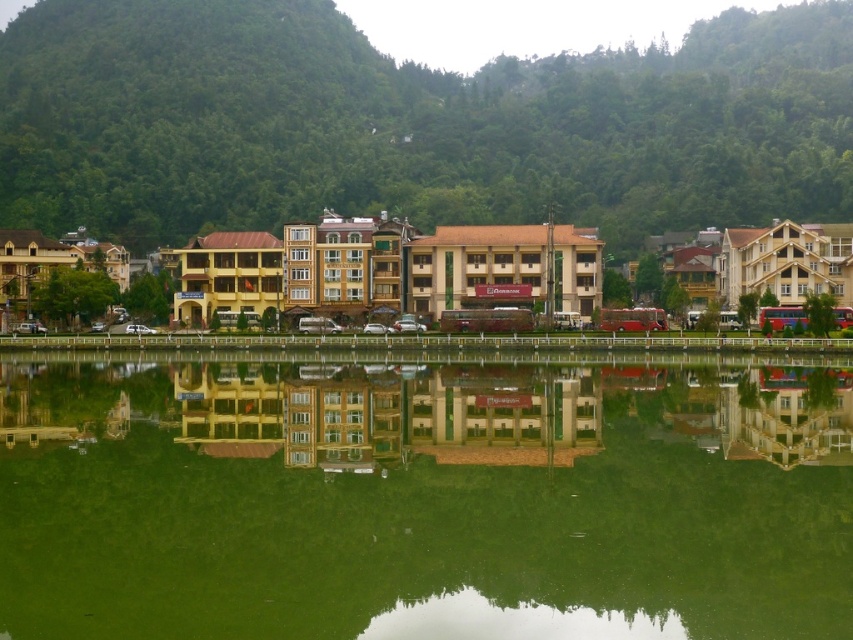
Which is above, green reflective water at center or green leafy hillside at upper center?

green leafy hillside at upper center is higher up.

Which is more to the left, green reflective water at center or green leafy hillside at upper center?

green leafy hillside at upper center is more to the left.

Between point (68, 368) and point (712, 106), which one is positioned behind?

Point (712, 106)

Locate an element on the screen. Image resolution: width=853 pixels, height=640 pixels. green reflective water at center is located at coordinates (422, 499).